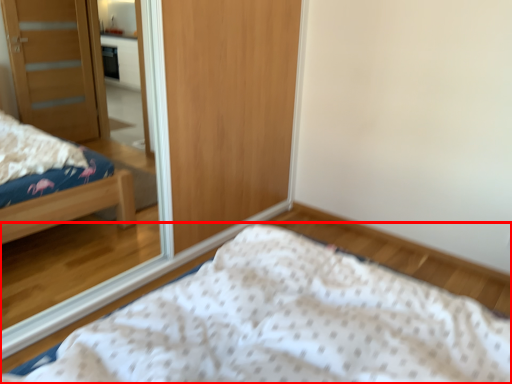
Question: From the image's perspective, where is bed (annotated by the red box) located in relation to mirror in the image?

Choices:
 (A) below
 (B) above

Answer: (A)